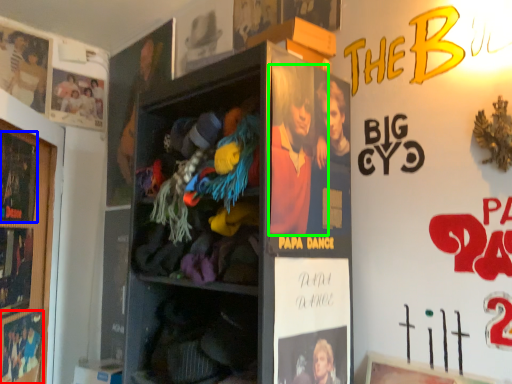
Question: Estimate the real-world distances between objects in this image. Which object is farther from movie poster (highlighted by a red box), advertisement (highlighted by a blue box) or person (highlighted by a green box)?

Choices:
 (A) advertisement
 (B) person

Answer: (B)